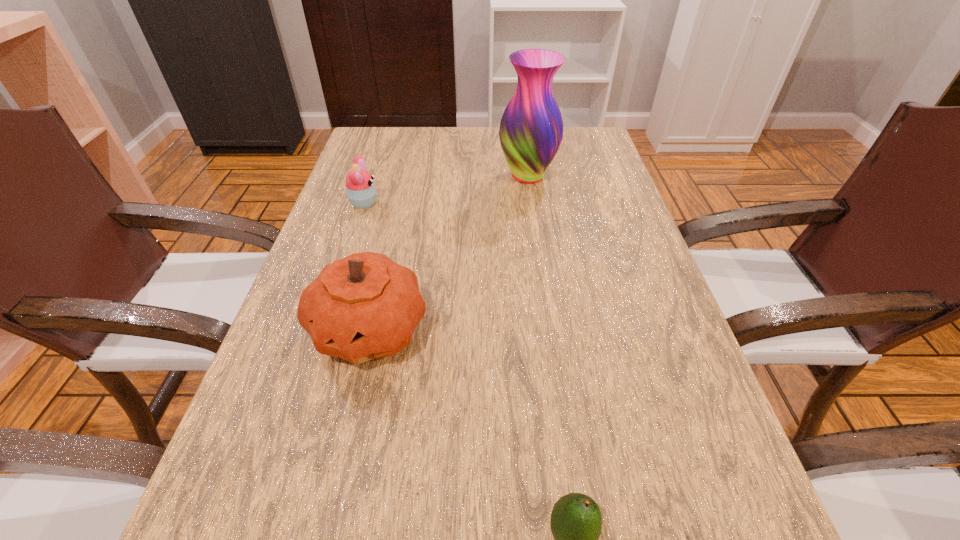
In order to click on object that is the closest to the third tallest object in this screenshot , I will do [x=365, y=306].

Where is `the third closest object relative to the third shortest object`? This screenshot has height=540, width=960. the third closest object relative to the third shortest object is located at coordinates (531, 129).